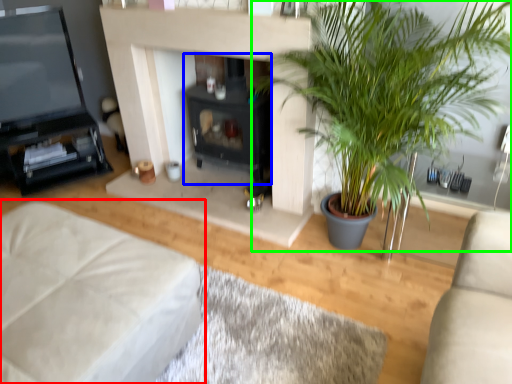
Question: Which is farther away from studio couch (highlighted by a red box)? fireplace (highlighted by a blue box) or houseplant (highlighted by a green box)?

Choices:
 (A) fireplace
 (B) houseplant

Answer: (A)